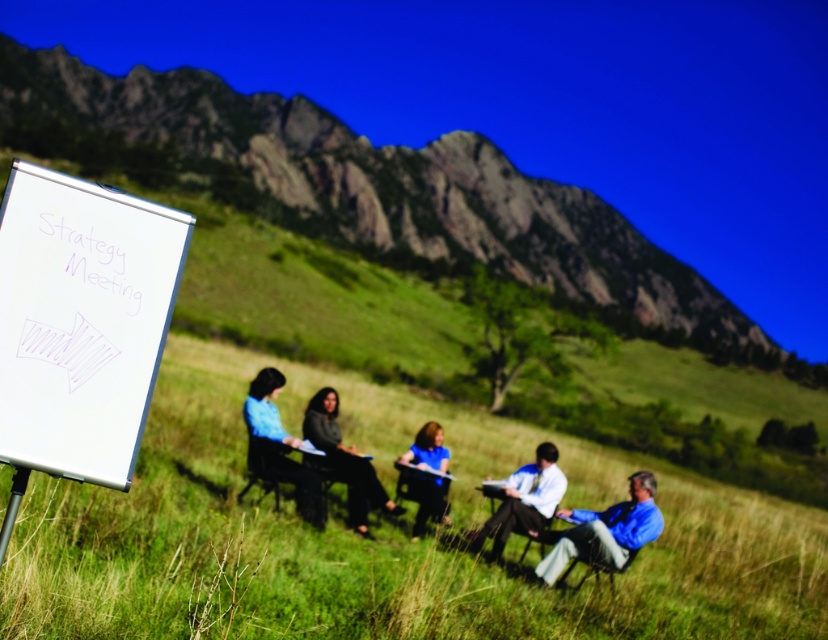
You are part of the meeting and need to pass a document to the person in the blue shirt at center. The metallic folding chair at center is between you and them. Can you pass the document without moving the chair?

The blue shirt at center is wider than the metallic folding chair at center, so you can pass the document to the blue shirt at center without moving the chair because the shirt is wider, indicating the person is larger and can reach around the chair.

You are a photographer positioned behind the group to capture their meeting. You want to ensure both the blue fabric chair at lower right and the metallic folding chair at center are clearly visible in your photo. Which chair should you position closer to the camera to avoid it being blocked by the other?

The blue fabric chair at lower right is in front of the metallic folding chair at center. To ensure both are visible, position the blue fabric chair at lower right closer to the camera since it is already in front and will not block the metallic folding chair at center if placed properly.

You are part of the group in the strategy meeting. You need to pass a document to the person wearing the blue shirt at center. Since you are sitting in the metallic folding chair at center, on which side should you pass the document?

The blue shirt at center is to the left of the metallic folding chair at center, so you should pass the document to the left side.